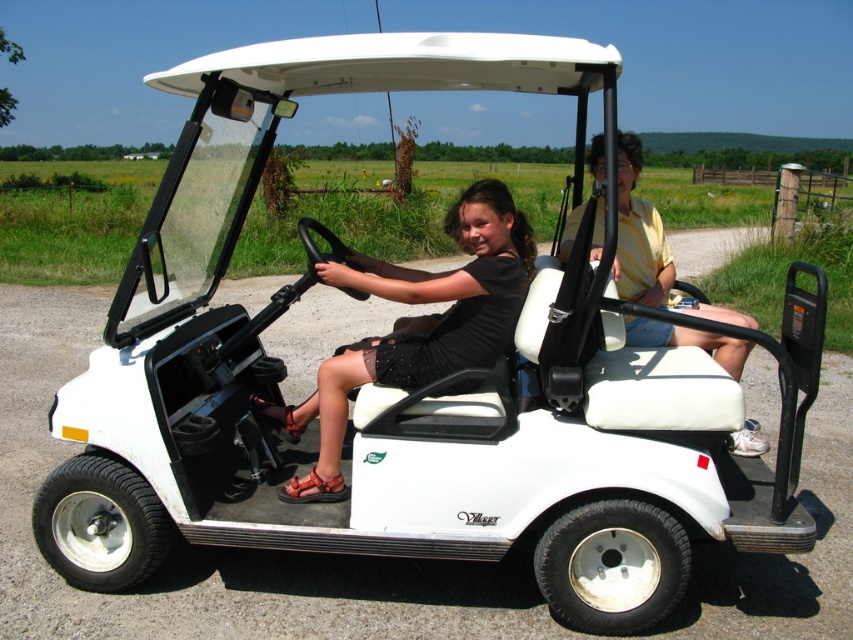
You are a photographer aiming to capture a closeup of the black matte dress at center and the white leather seat at center without any distortion. What is the minimum distance your camera lens should have to ensure both objects are in focus and clear?

The black matte dress at center is 32.38 inches away from the white leather seat at center. To capture both in focus, the lens should have a minimum focal length of 50mm.

You are a photographer planning to take a closeup shot of the black matte dress at center and the white leather seat at center. Which object should you focus on first if you want to capture both clearly in sharp focus?

The black matte dress at center is positioned under the white leather seat at center, so you should focus on the white leather seat at center first to ensure both are in focus.